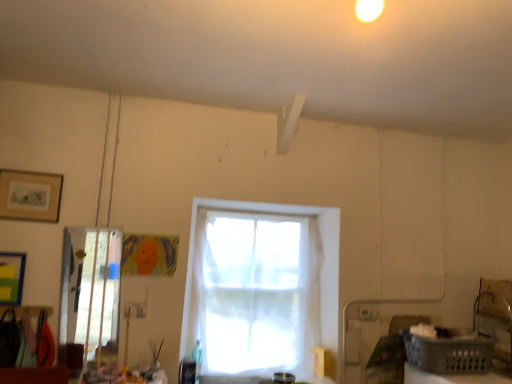
Question: Is white sheer curtain at center thinner than matte black picture frame at upper left?

Choices:
 (A) yes
 (B) no

Answer: (B)

Question: Is white sheer curtain at center located outside matte black picture frame at upper left?

Choices:
 (A) yes
 (B) no

Answer: (A)

Question: Is white sheer curtain at center behind matte black picture frame at upper left?

Choices:
 (A) no
 (B) yes

Answer: (B)

Question: From a real-world perspective, is white sheer curtain at center positioned over matte black picture frame at upper left based on gravity?

Choices:
 (A) no
 (B) yes

Answer: (A)

Question: Does white sheer curtain at center come in front of matte black picture frame at upper left?

Choices:
 (A) yes
 (B) no

Answer: (B)

Question: Considering the relative sizes of white sheer curtain at center and matte black picture frame at upper left in the image provided, is white sheer curtain at center shorter than matte black picture frame at upper left?

Choices:
 (A) yes
 (B) no

Answer: (B)

Question: Is matte black picture frame at upper left smaller than gray plastic basket at lower right?

Choices:
 (A) yes
 (B) no

Answer: (A)

Question: Could you tell me if matte black picture frame at upper left is facing gray plastic basket at lower right?

Choices:
 (A) yes
 (B) no

Answer: (B)

Question: Are matte black picture frame at upper left and gray plastic basket at lower right beside each other?

Choices:
 (A) no
 (B) yes

Answer: (A)

Question: From the image's perspective, does matte black picture frame at upper left appear higher than gray plastic basket at lower right?

Choices:
 (A) yes
 (B) no

Answer: (A)

Question: Does matte black picture frame at upper left have a lesser width compared to gray plastic basket at lower right?

Choices:
 (A) no
 (B) yes

Answer: (B)

Question: Is matte black picture frame at upper left facing away from gray plastic basket at lower right?

Choices:
 (A) yes
 (B) no

Answer: (B)

Question: Is matte black picture frame at upper left surrounded by gray plastic basket at lower right?

Choices:
 (A) yes
 (B) no

Answer: (B)